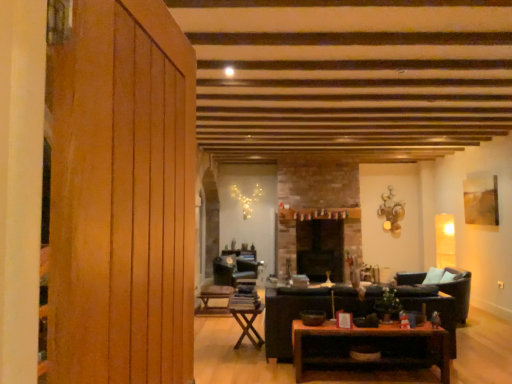
Question: From a real-world perspective, is black leather couch at center positioned under wooden paneling at left based on gravity?

Choices:
 (A) yes
 (B) no

Answer: (A)

Question: Is black leather couch at center further to the viewer compared to wooden paneling at left?

Choices:
 (A) no
 (B) yes

Answer: (B)

Question: From the image's perspective, does black leather couch at center appear lower than wooden paneling at left?

Choices:
 (A) no
 (B) yes

Answer: (B)

Question: Can you confirm if black leather couch at center is bigger than wooden paneling at left?

Choices:
 (A) no
 (B) yes

Answer: (B)

Question: From the image's perspective, is black leather couch at center above wooden paneling at left?

Choices:
 (A) no
 (B) yes

Answer: (A)

Question: Considering their positions, is velvet dark green armchair at center, the 2th armchair positioned from the right, located in front of or behind wooden folding table at center, arranged as the third table when viewed from the right?

Choices:
 (A) behind
 (B) front

Answer: (A)

Question: From the image's perspective, is velvet dark green armchair at center, the first armchair when ordered from back to front, located above or below wooden folding table at center, arranged as the third table when viewed from the right?

Choices:
 (A) above
 (B) below

Answer: (A)

Question: In terms of width, does velvet dark green armchair at center, the first armchair when ordered from back to front, look wider or thinner when compared to wooden folding table at center, positioned as the 1th table in back-to-front order?

Choices:
 (A) wide
 (B) thin

Answer: (A)

Question: From a real-world perspective, is velvet dark green armchair at center, arranged as the 2th armchair when viewed from the front, above or below wooden folding table at center, which ranks as the 1th table in left-to-right order?

Choices:
 (A) below
 (B) above

Answer: (B)

Question: From a real-world perspective, is brown wooden table at center, the third table from the back, physically located above or below wooden folding table at center, positioned as the 1th table in back-to-front order?

Choices:
 (A) below
 (B) above

Answer: (B)

Question: From the image's perspective, relative to wooden folding table at center, which is the 3th table from front to back, is brown wooden table at center, marked as the first table in a front-to-back arrangement, above or below?

Choices:
 (A) below
 (B) above

Answer: (B)

Question: Is brown wooden table at center, the third table from the back, wider or thinner than wooden folding table at center, which is the 3th table from front to back?

Choices:
 (A) thin
 (B) wide

Answer: (A)

Question: Do you think brown wooden table at center, the first table from the right, is within wooden folding table at center, which ranks as the 1th table in left-to-right order, or outside of it?

Choices:
 (A) outside
 (B) inside

Answer: (A)

Question: From the image's perspective, is wooden folding table at center, the 2th table from the back, positioned above or below black leather couch at center?

Choices:
 (A) above
 (B) below

Answer: (B)

Question: Considering their positions, is wooden folding table at center, which appears as the second table when viewed from the right, located in front of or behind black leather couch at center?

Choices:
 (A) behind
 (B) front

Answer: (A)